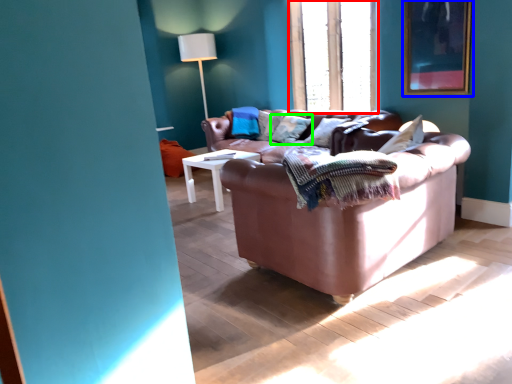
Question: Based on their relative distances, which object is farther from window frame (highlighted by a red box)? Choose from picture frame (highlighted by a blue box) and pillow (highlighted by a green box).

Choices:
 (A) picture frame
 (B) pillow

Answer: (B)